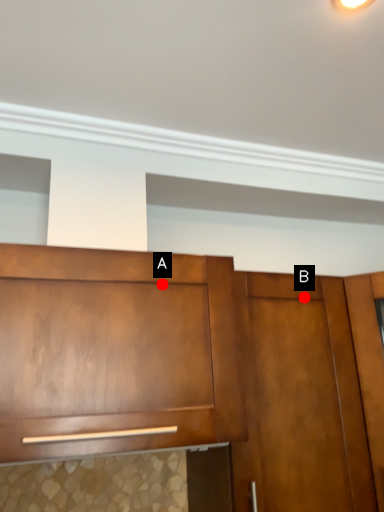
Question: Two points are circled on the image, labeled by A and B beside each circle. Which of the following is the closest to the observer?

Choices:
 (A) A is closer
 (B) B is closer

Answer: (A)